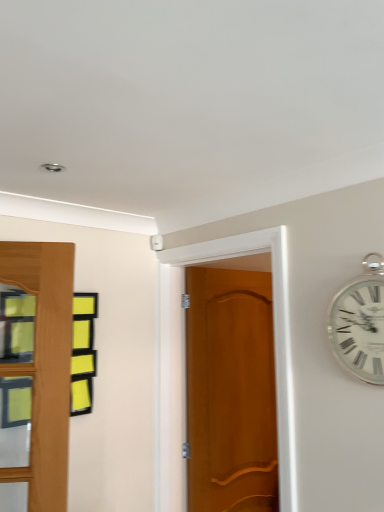
This screenshot has width=384, height=512. What do you see at coordinates (359, 328) in the screenshot?
I see `silver metallic clock at upper right` at bounding box center [359, 328].

At what (x,y) coordinates should I click in order to perform the action: click on silver metallic clock at upper right. Please return your answer as a coordinate pair (x, y). Looking at the image, I should click on (359, 328).

What do you see at coordinates (185, 362) in the screenshot?
I see `wooden door at center` at bounding box center [185, 362].

Where is `wooden door at center`? This screenshot has height=512, width=384. wooden door at center is located at coordinates (185, 362).

Where is `silver metallic clock at upper right`? silver metallic clock at upper right is located at coordinates (359, 328).

Considering the positions of objects silver metallic clock at upper right and wooden door at center in the image provided, who is more to the left, silver metallic clock at upper right or wooden door at center?

From the viewer's perspective, wooden door at center appears more on the left side.

Is silver metallic clock at upper right in front of wooden door at center?

Yes, the depth of silver metallic clock at upper right is less than that of wooden door at center.

Is point (380, 357) closer or farther from the camera than point (287, 303)?

Point (380, 357) is positioned closer to the camera compared to point (287, 303).

From the image's perspective, does silver metallic clock at upper right appear higher than wooden door at center?

Yes.

From a real-world perspective, who is located lower, silver metallic clock at upper right or wooden door at center?

wooden door at center is physically lower.

Which of these two, silver metallic clock at upper right or wooden door at center, is wider?

wooden door at center is wider.

Considering the relative sizes of silver metallic clock at upper right and wooden door at center in the image provided, is silver metallic clock at upper right shorter than wooden door at center?

Indeed, silver metallic clock at upper right has a lesser height compared to wooden door at center.

Does silver metallic clock at upper right have a larger size compared to wooden door at center?

No, silver metallic clock at upper right is not bigger than wooden door at center.

Would you say silver metallic clock at upper right is outside wooden door at center?

Absolutely, silver metallic clock at upper right is external to wooden door at center.

Is silver metallic clock at upper right far from wooden door at center?

They are positioned close to each other.

Looking at this image, does silver metallic clock at upper right turn towards wooden door at center?

No, silver metallic clock at upper right does not turn towards wooden door at center.

Measure the distance between silver metallic clock at upper right and wooden door at center.

silver metallic clock at upper right and wooden door at center are 20.78 inches apart.

I want to click on door beneath the silver metallic clock at upper right (from a real-world perspective), so click(185, 362).

Considering the positions of objects wooden door at center and silver metallic clock at upper right in the image provided, who is more to the left, wooden door at center or silver metallic clock at upper right?

Positioned to the left is wooden door at center.

Does wooden door at center come in front of silver metallic clock at upper right?

No, wooden door at center is behind silver metallic clock at upper right.

Is point (162, 396) closer to camera compared to point (350, 287)?

No, (162, 396) is behind (350, 287).

From the image's perspective, between wooden door at center and silver metallic clock at upper right, who is located below?

wooden door at center, from the image's perspective.

From a real-world perspective, relative to silver metallic clock at upper right, is wooden door at center vertically above or below?

wooden door at center is below silver metallic clock at upper right.

Which object is thinner, wooden door at center or silver metallic clock at upper right?

silver metallic clock at upper right.

In terms of height, does wooden door at center look taller or shorter compared to silver metallic clock at upper right?

Considering their sizes, wooden door at center has more height than silver metallic clock at upper right.

Is wooden door at center bigger than silver metallic clock at upper right?

Yes.

Would you say wooden door at center is outside silver metallic clock at upper right?

Absolutely, wooden door at center is external to silver metallic clock at upper right.

Is wooden door at center far from silver metallic clock at upper right?

They are positioned close to each other.

Is wooden door at center oriented away from silver metallic clock at upper right?

No, wooden door at center is not facing the opposite direction of silver metallic clock at upper right.

What's the angular difference between wooden door at center and silver metallic clock at upper right's facing directions?

wooden door at center and silver metallic clock at upper right are facing 0.12 degrees away from each other.

You are a GUI agent. You are given a task and a screenshot of the screen. Output one action in this format:
    pyautogui.click(x=<x>, y=<y>)
    Task: Click on the door lying behind the silver metallic clock at upper right
    
    Given the screenshot: What is the action you would take?
    pyautogui.click(x=185, y=362)

The height and width of the screenshot is (512, 384). I want to click on door below the silver metallic clock at upper right (from a real-world perspective), so click(x=185, y=362).

At what (x,y) coordinates should I click in order to perform the action: click on wall clock in front of the wooden door at center. Please return your answer as a coordinate pair (x, y). The height and width of the screenshot is (512, 384). Looking at the image, I should click on (359, 328).